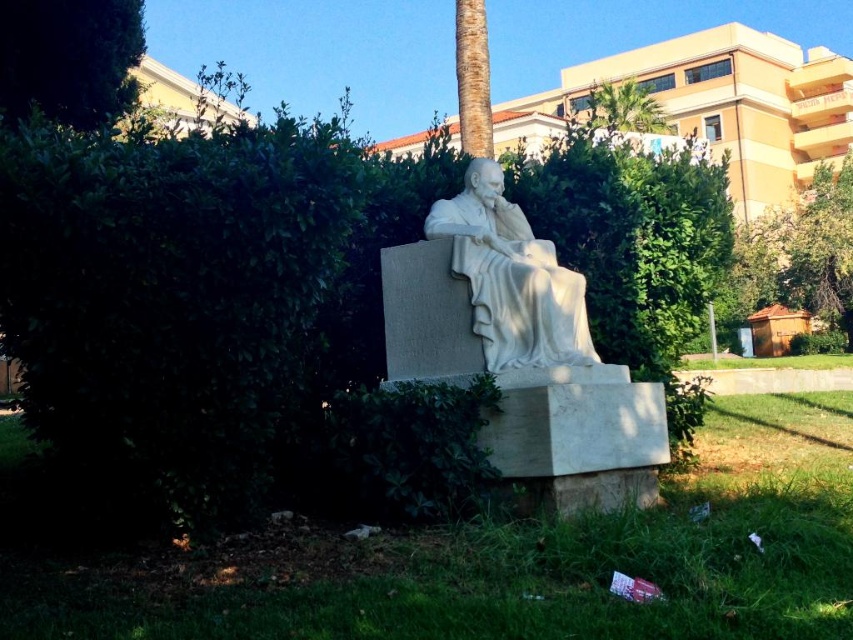
Looking at this image, does white marble statue at center appear over green leafy tree at upper left?

Actually, white marble statue at center is below green leafy tree at upper left.

Identify the location of white marble statue at center. This screenshot has width=853, height=640. (511, 276).

Between green leafy tree at upper left and green leafy tree at upper right, which one has less height?

green leafy tree at upper left

Can you confirm if green leafy tree at upper left is positioned above green leafy tree at upper right?

Actually, green leafy tree at upper left is below green leafy tree at upper right.

Is point (85, 125) less distant than point (764, 253)?

Yes, it is in front of point (764, 253).

Find the location of `green leafy tree at upper left`. green leafy tree at upper left is located at coordinates (68, 58).

Looking at this image, how distant is green leafy tree at upper right from green leafy palm tree at upper center?

green leafy tree at upper right and green leafy palm tree at upper center are 15.88 feet apart.

Does green leafy tree at upper right have a larger size compared to green leafy palm tree at upper center?

Actually, green leafy tree at upper right might be smaller than green leafy palm tree at upper center.

At what (x,y) coordinates should I click in order to perform the action: click on green leafy tree at upper right. Please return your answer as a coordinate pair (x, y). Looking at the image, I should click on (802, 252).